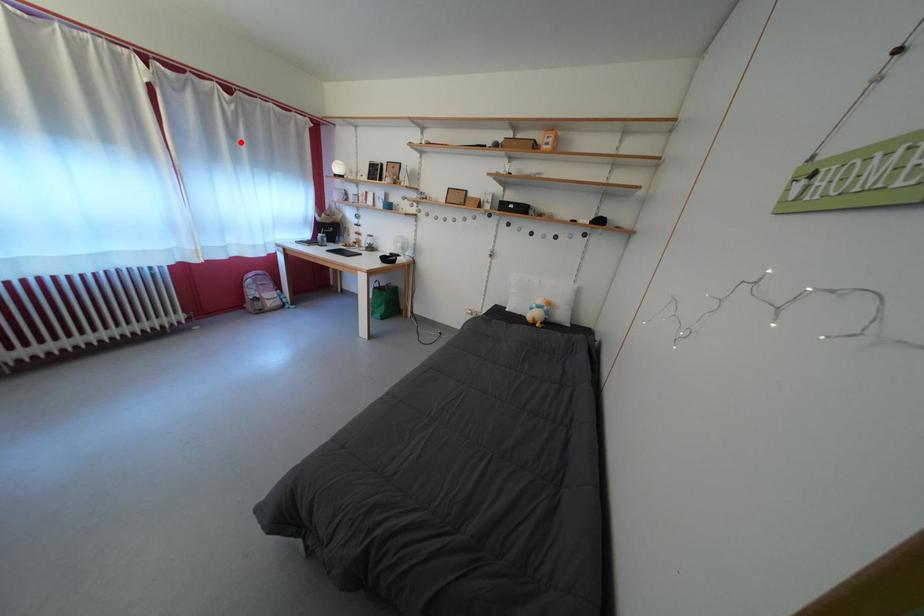
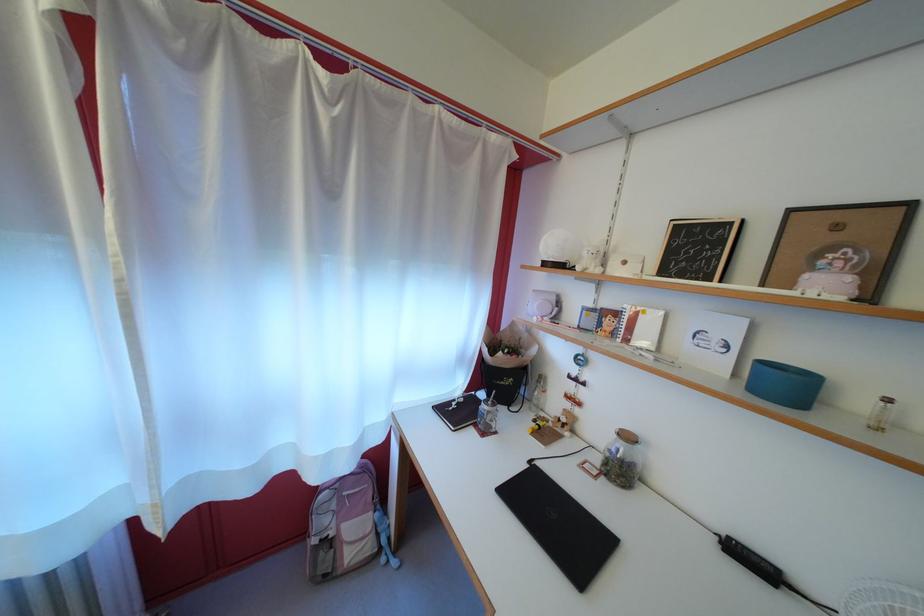
Locate, in the second image, the point that corresponds to the highlighted location in the first image.

(335, 193)